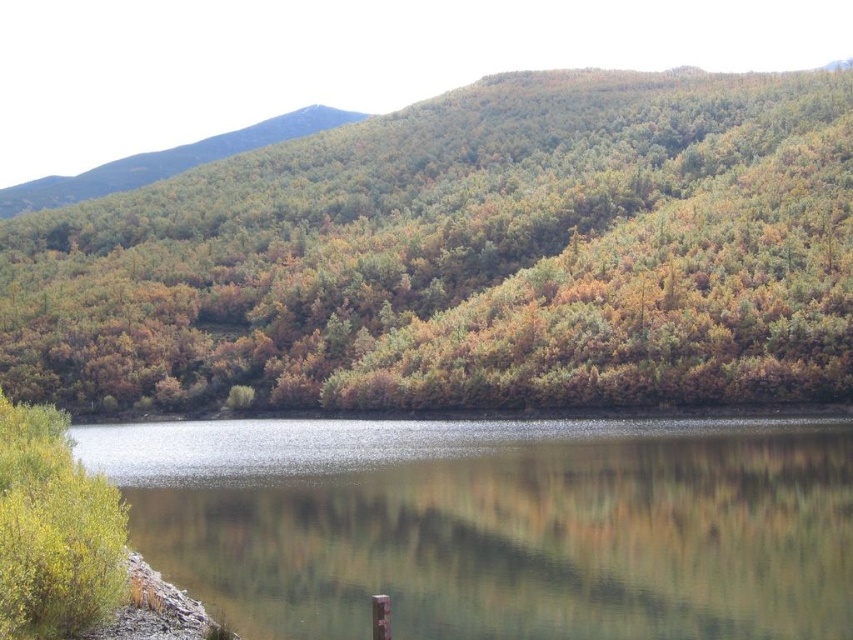
Based on the coordinates provided, which object is located at point [466,259] in the image?

The point [466,259] marks the green matte forest at upper center.